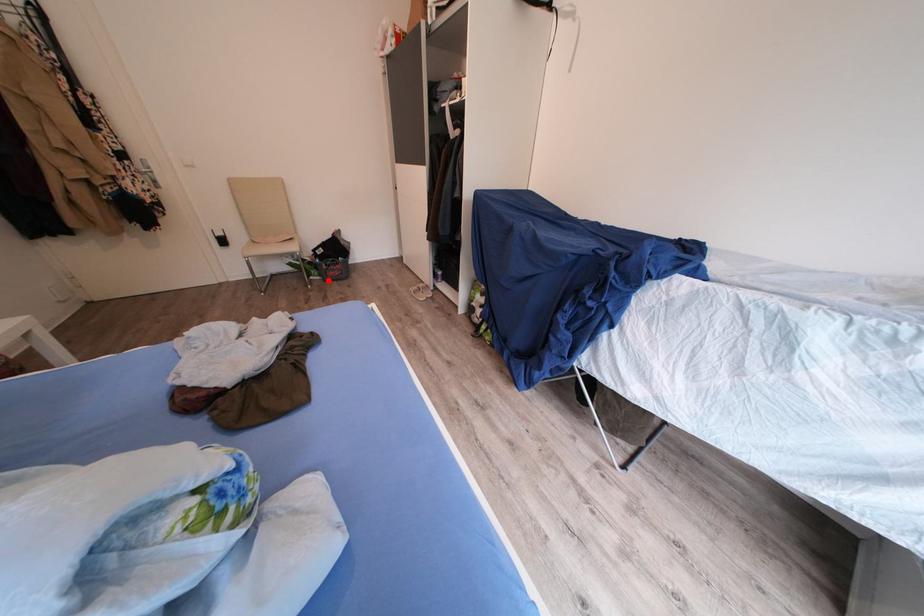
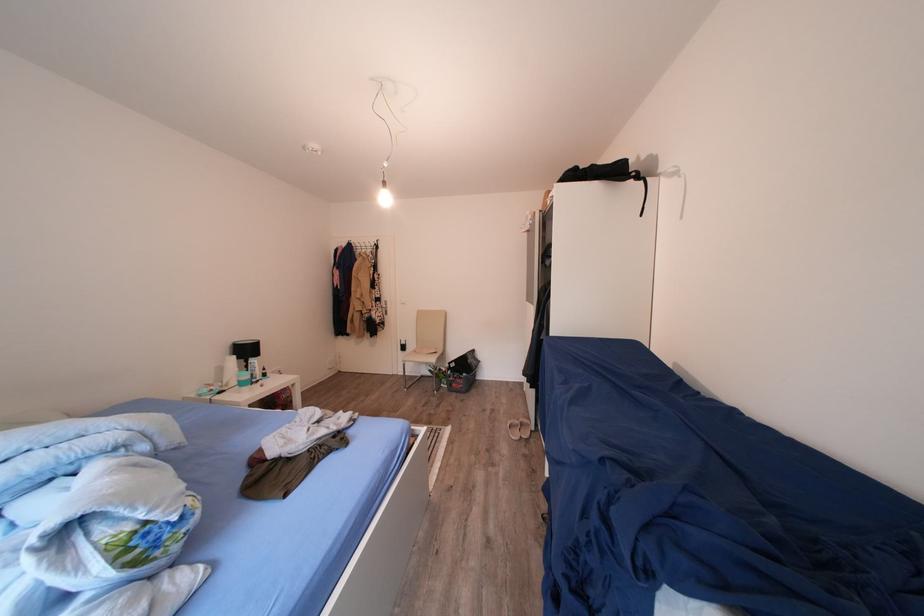
Question: I am providing you with two images of the same scene from different viewpoints. A red point is marked on the first image. Can you still see the location of the red point in image 2?

Choices:
 (A) Yes
 (B) No

Answer: (A)